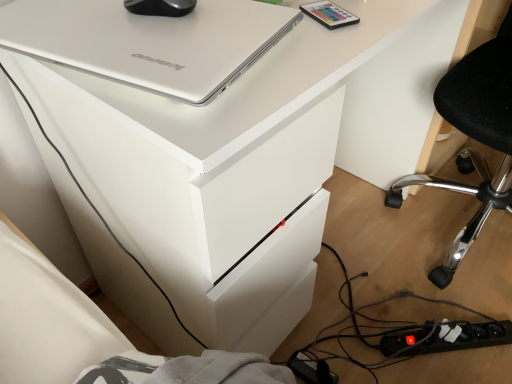
Identify the location of vacant space to the right of matte plastic remote control at upper right. (384, 13).